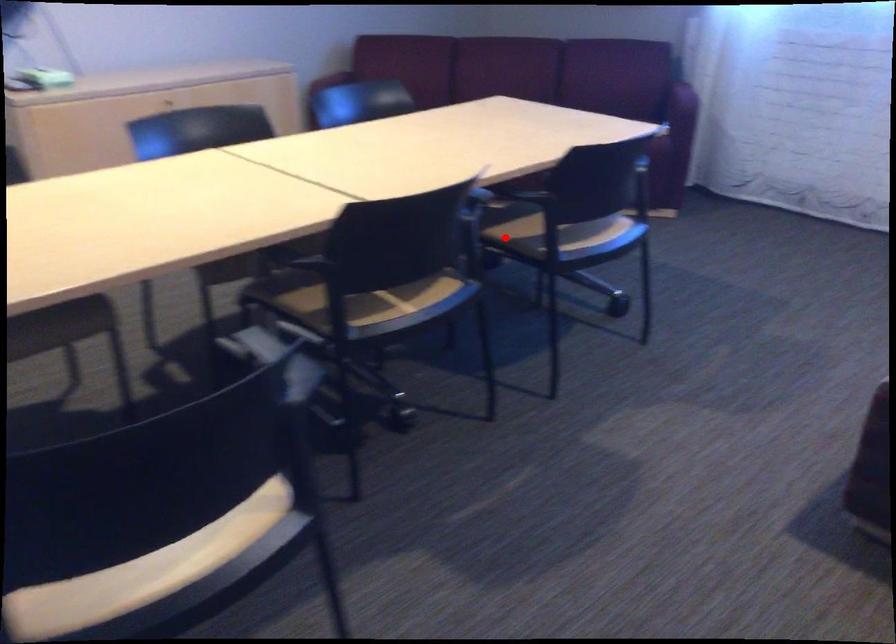
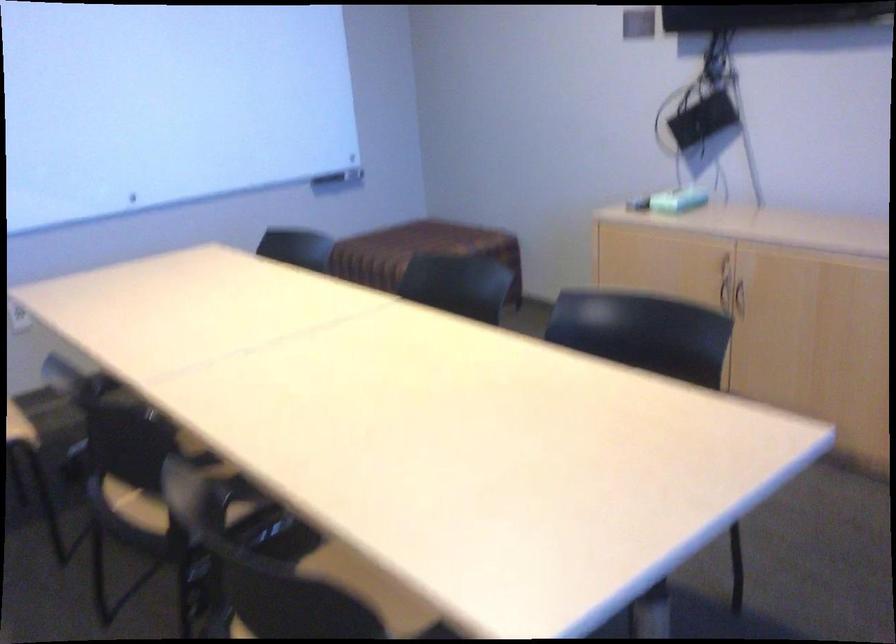
In the second image, find the point that corresponds to the highlighted location in the first image.

(337, 569)